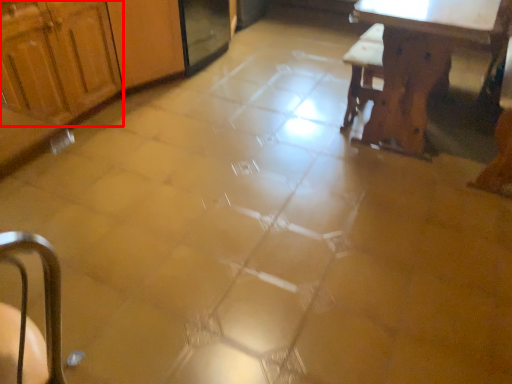
Question: Observing the image, what is the correct spatial positioning of cabinetry (annotated by the red box) in reference to table?

Choices:
 (A) right
 (B) left

Answer: (B)